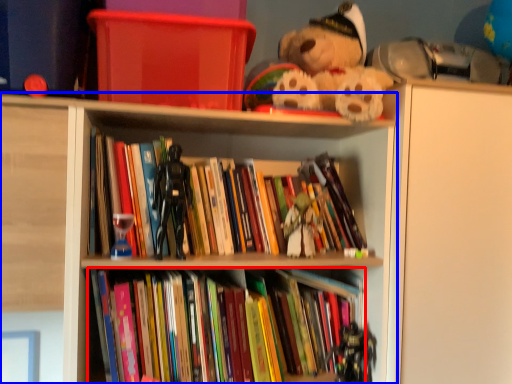
Question: Which point is closer to the camera, book (highlighted by a red box) or shelf (highlighted by a blue box)?

Choices:
 (A) book
 (B) shelf

Answer: (B)